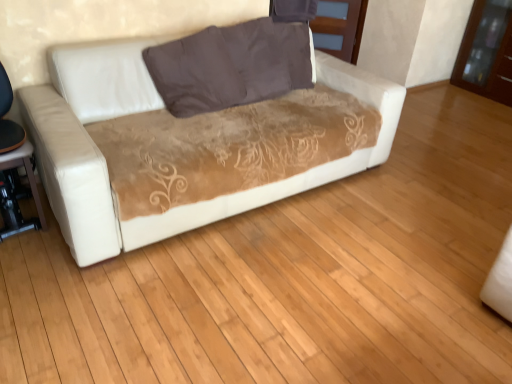
This screenshot has height=384, width=512. I want to click on free location to the right of matte black table at lower left, so click(x=47, y=240).